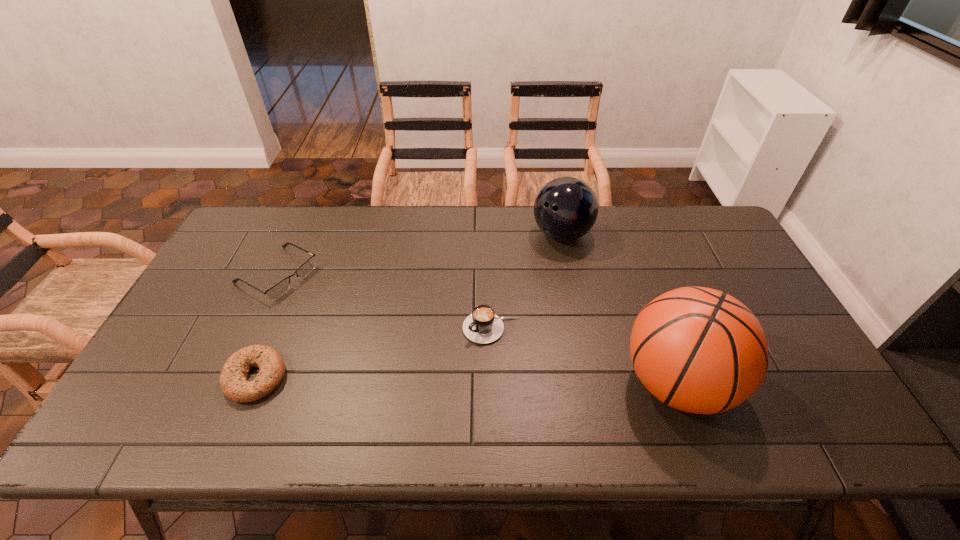
Identify the location of object that stands as the closest to the cappuccino. This screenshot has height=540, width=960. (699, 350).

The width and height of the screenshot is (960, 540). Identify the location of free space that satisfies the following two spatial constraints: 1. on the front side of the basketball; 2. on the right side of the second tallest object. (592, 383).